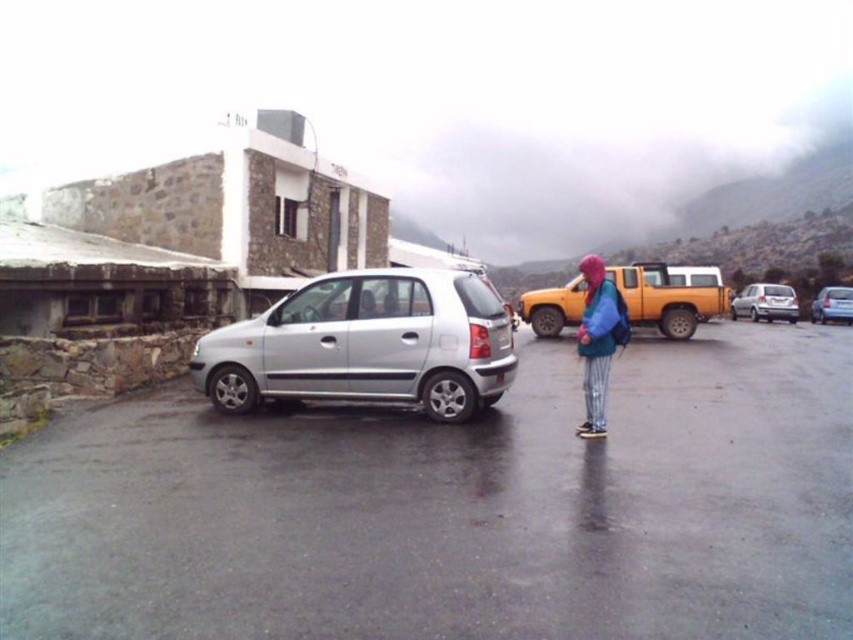
You are a delivery person who needs to place a package on the ground between the blue fleece jacket at center and the metallic blue sedan at right. The package requires a minimum of 20 meters of space to ensure safety. Can you safely place the package there?

The blue fleece jacket at center and the metallic blue sedan at right are 18.84 meters apart from each other, which is less than the required 20 meters. Therefore, placing the package between them would not meet the safety requirement.